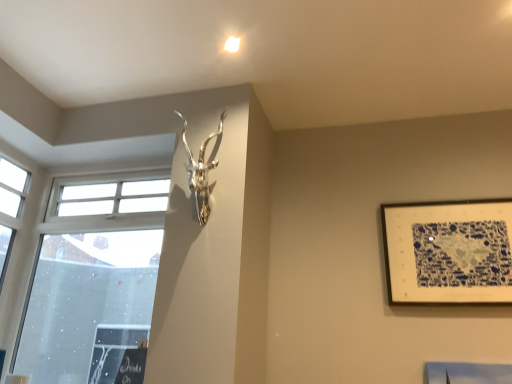
Question: Is transparent glass window at left at the right side of blue and white paper at upper right?

Choices:
 (A) no
 (B) yes

Answer: (A)

Question: Is transparent glass window at left smaller than blue and white paper at upper right?

Choices:
 (A) no
 (B) yes

Answer: (A)

Question: Can you confirm if transparent glass window at left is shorter than blue and white paper at upper right?

Choices:
 (A) no
 (B) yes

Answer: (A)

Question: Can you confirm if transparent glass window at left is taller than blue and white paper at upper right?

Choices:
 (A) no
 (B) yes

Answer: (B)

Question: Is transparent glass window at left positioned beyond the bounds of blue and white paper at upper right?

Choices:
 (A) yes
 (B) no

Answer: (A)

Question: From their relative heights in the image, would you say transparent glass window at left is taller or shorter than silver metallic antler at upper center?

Choices:
 (A) short
 (B) tall

Answer: (B)

Question: Is transparent glass window at left situated inside silver metallic antler at upper center or outside?

Choices:
 (A) outside
 (B) inside

Answer: (A)

Question: From the image's perspective, relative to silver metallic antler at upper center, is transparent glass window at left above or below?

Choices:
 (A) below
 (B) above

Answer: (A)

Question: Considering the positions of point (88, 249) and point (188, 163), is point (88, 249) closer or farther from the camera than point (188, 163)?

Choices:
 (A) farther
 (B) closer

Answer: (A)

Question: In terms of height, does transparent glass window at left look taller or shorter compared to blue and white paper at upper right?

Choices:
 (A) tall
 (B) short

Answer: (A)

Question: From the image's perspective, is transparent glass window at left located above or below blue and white paper at upper right?

Choices:
 (A) above
 (B) below

Answer: (B)

Question: Is point [x=134, y=299] closer or farther from the camera than point [x=454, y=216]?

Choices:
 (A) farther
 (B) closer

Answer: (A)

Question: In the image, is transparent glass window at left on the left side or the right side of blue and white paper at upper right?

Choices:
 (A) left
 (B) right

Answer: (A)

Question: From a real-world perspective, relative to silver metallic antler at upper center, is blue and white paper at upper right vertically above or below?

Choices:
 (A) above
 (B) below

Answer: (B)

Question: Is blue and white paper at upper right taller or shorter than silver metallic antler at upper center?

Choices:
 (A) tall
 (B) short

Answer: (B)